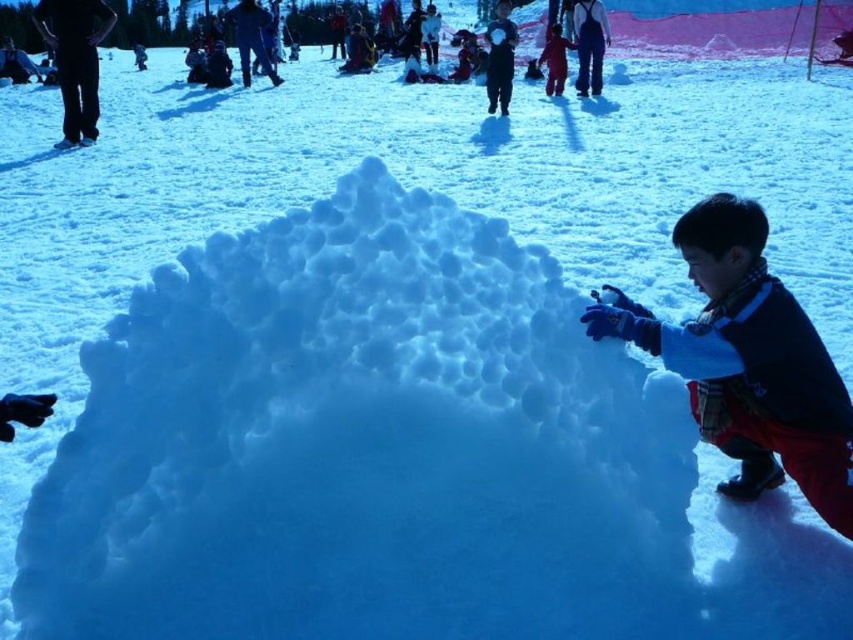
Question: Does black pants at upper left lie in front of matte red snowsuit at center?

Choices:
 (A) yes
 (B) no

Answer: (A)

Question: Which object appears closest to the camera in this image?

Choices:
 (A) matte red snowsuit at center
 (B) black pants at upper left

Answer: (B)

Question: Can you confirm if dark blue wool scarf at lower right is thinner than black pants at upper left?

Choices:
 (A) yes
 (B) no

Answer: (A)

Question: Does dark blue wool scarf at lower right come behind black pants at upper left?

Choices:
 (A) yes
 (B) no

Answer: (B)

Question: Which point appears closest to the camera in this image?

Choices:
 (A) (583, 68)
 (B) (552, 68)
 (C) (57, 28)

Answer: (C)

Question: Estimate the real-world distances between objects in this image. Which object is farther from the dark blue wool scarf at lower right?

Choices:
 (A) matte red snowsuit at center
 (B) dark blue snowsuit at upper right

Answer: (B)